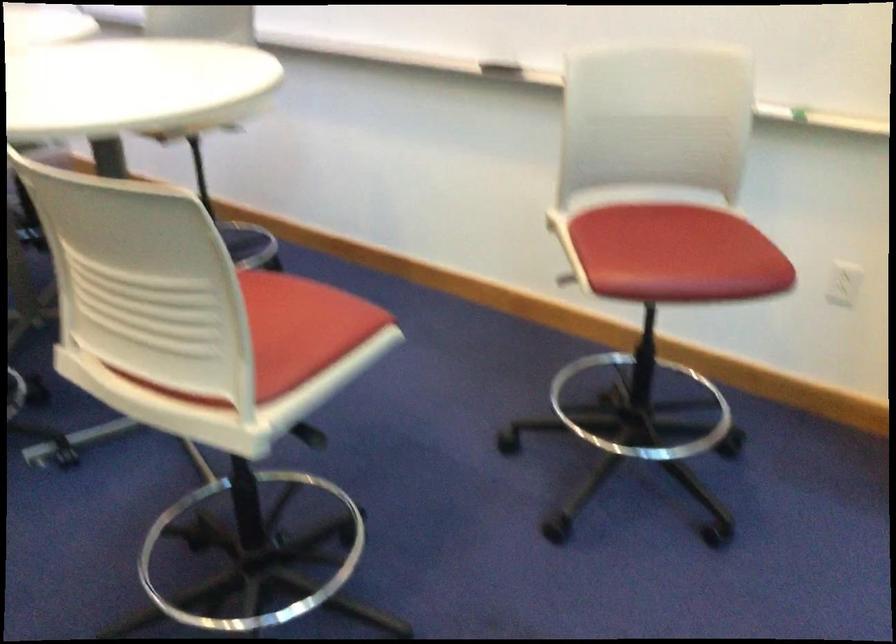
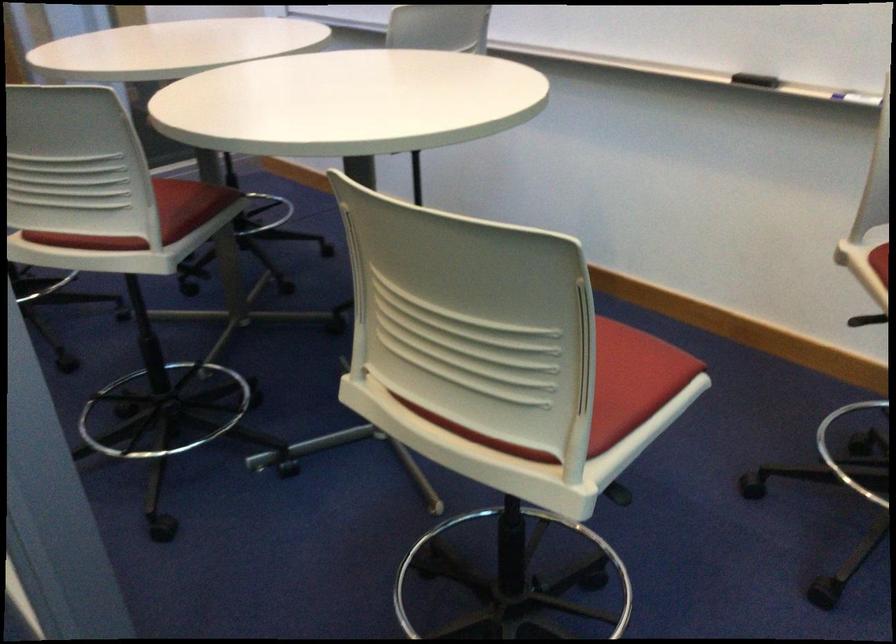
Where in the second image is the point corresponding to pixel 576 222 from the first image?

(880, 261)